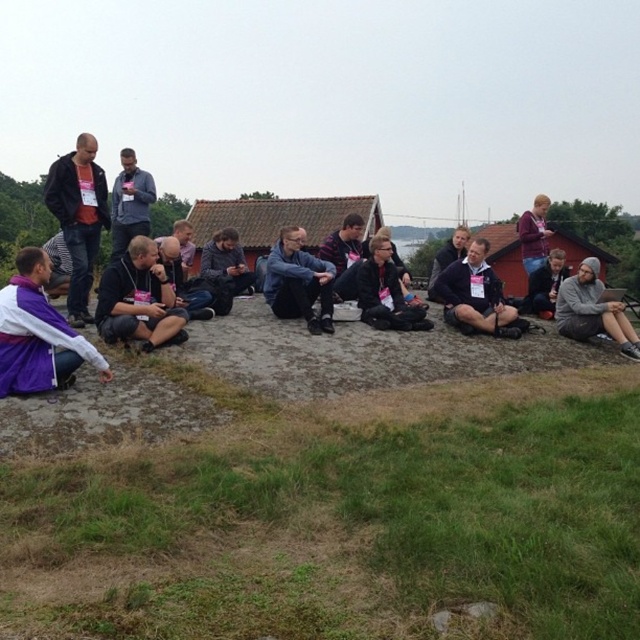
Can you confirm if gray fuzzy hoodie at lower right is positioned to the left of dark blue jacket at center?

In fact, gray fuzzy hoodie at lower right is to the right of dark blue jacket at center.

Who is higher up, gray fuzzy hoodie at lower right or dark blue jacket at center?

dark blue jacket at center is higher up.

In order to click on gray fuzzy hoodie at lower right in this screenshot , I will do `click(593, 310)`.

Identify the location of gray fuzzy hoodie at lower right. (593, 310).

Who is more forward, (467, 256) or (596, 294)?

Point (596, 294)

Is dark blue jeans at center to the right of gray fuzzy hoodie at lower right from the viewer's perspective?

No, dark blue jeans at center is not to the right of gray fuzzy hoodie at lower right.

Describe the element at coordinates (476, 296) in the screenshot. The height and width of the screenshot is (640, 640). I see `dark blue jeans at center` at that location.

At what (x,y) coordinates should I click in order to perform the action: click on dark blue jeans at center. Please return your answer as a coordinate pair (x, y). The height and width of the screenshot is (640, 640). Looking at the image, I should click on (476, 296).

Is dark gray hoodie at left taller than dark blue jeans at center?

Yes, dark gray hoodie at left is taller than dark blue jeans at center.

Is point (74, 307) behind point (490, 298)?

No.

Where is `dark gray hoodie at left`? The width and height of the screenshot is (640, 640). dark gray hoodie at left is located at coordinates (77, 218).